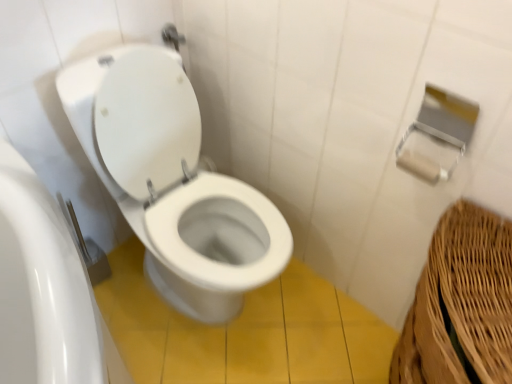
Question: Does white glossy toilet at center turn towards white matte toilet paper at upper right?

Choices:
 (A) no
 (B) yes

Answer: (A)

Question: Is white glossy toilet at center looking in the opposite direction of white matte toilet paper at upper right?

Choices:
 (A) yes
 (B) no

Answer: (B)

Question: Is white glossy toilet at center further to the viewer compared to white matte toilet paper at upper right?

Choices:
 (A) yes
 (B) no

Answer: (B)

Question: Does white glossy toilet at center have a larger size compared to white matte toilet paper at upper right?

Choices:
 (A) no
 (B) yes

Answer: (B)

Question: From the image's perspective, is white glossy toilet at center over white matte toilet paper at upper right?

Choices:
 (A) yes
 (B) no

Answer: (B)

Question: Is white glossy toilet at center smaller than white matte toilet paper at upper right?

Choices:
 (A) no
 (B) yes

Answer: (A)

Question: Considering the relative positions of white matte toilet paper at upper right and white glossy toilet at center in the image provided, is white matte toilet paper at upper right to the left of white glossy toilet at center from the viewer's perspective?

Choices:
 (A) no
 (B) yes

Answer: (A)

Question: From a real-world perspective, is white matte toilet paper at upper right physically below white glossy toilet at center?

Choices:
 (A) yes
 (B) no

Answer: (B)

Question: Is the surface of white matte toilet paper at upper right in direct contact with white glossy toilet at center?

Choices:
 (A) yes
 (B) no

Answer: (B)

Question: Is white matte toilet paper at upper right shorter than white glossy toilet at center?

Choices:
 (A) yes
 (B) no

Answer: (A)

Question: Can you confirm if white matte toilet paper at upper right is thinner than white glossy toilet at center?

Choices:
 (A) no
 (B) yes

Answer: (B)

Question: Is the depth of white matte toilet paper at upper right greater than that of white glossy toilet at center?

Choices:
 (A) no
 (B) yes

Answer: (B)

Question: Is white glossy toilet at center in front of or behind white matte toilet paper at upper right in the image?

Choices:
 (A) front
 (B) behind

Answer: (A)